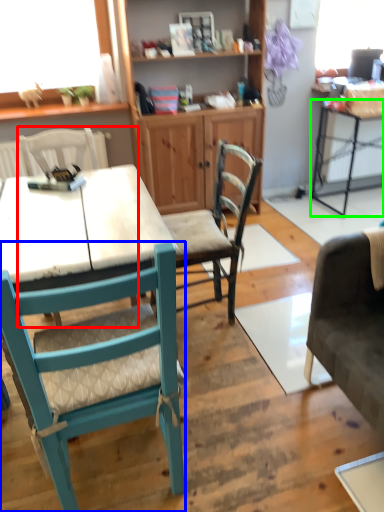
Question: Based on their relative distances, which object is nearer to chair (highlighted by a red box)? Choose from chair (highlighted by a blue box) and table (highlighted by a green box).

Choices:
 (A) chair
 (B) table

Answer: (A)